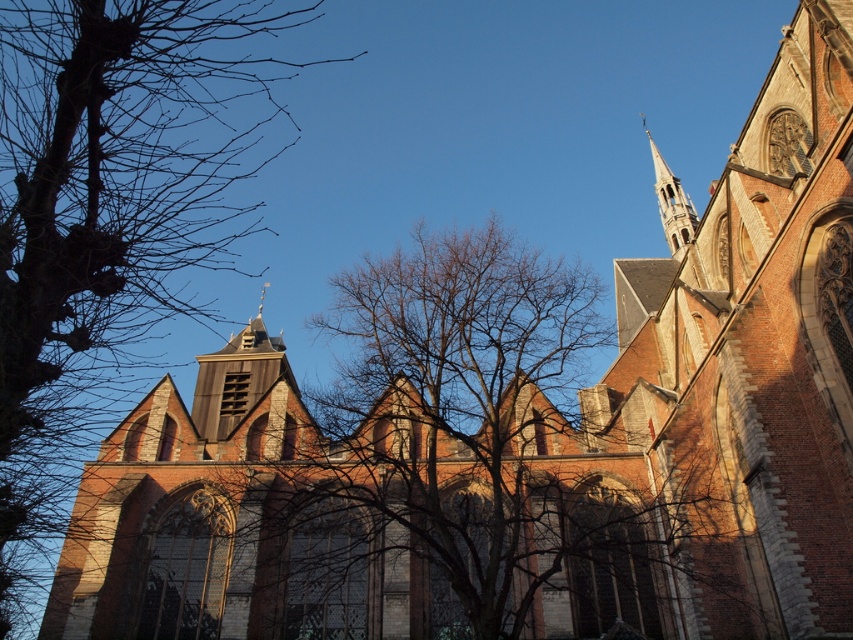
You are standing in a park and see the grand historic church with its tall spire. There is a point marked at coordinates [457,323]. What object is located at this point?

The point at coordinates [457,323] indicates bare branches at center.

From the picture: You are standing in front of the historic church and notice two points marked on the facade. Which point is closer to you? The points are labeled as point (520, 296) and point (674, 237).

Point (520, 296) is closer to you than point (674, 237).

You are a landscape architect designing a garden pathway that must pass between the bare branches at left and the bare branches at center. The pathway must be at least 150 feet long to accommodate a walking trail. Can the space between these two sets of branches accommodate the pathway?

The distance between the bare branches at left and the bare branches at center is 163.62 feet, which is longer than the required 150 feet. Therefore, the space can accommodate the pathway.